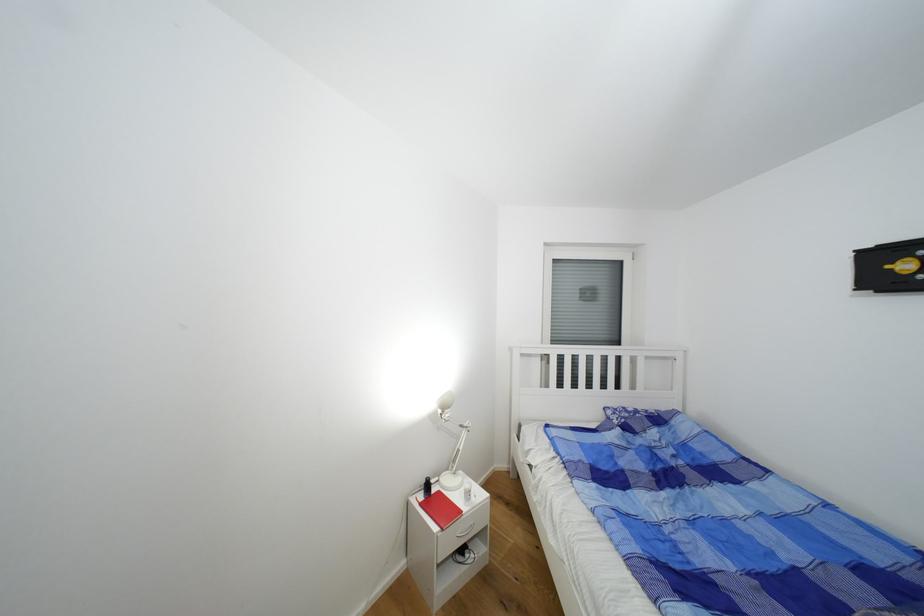
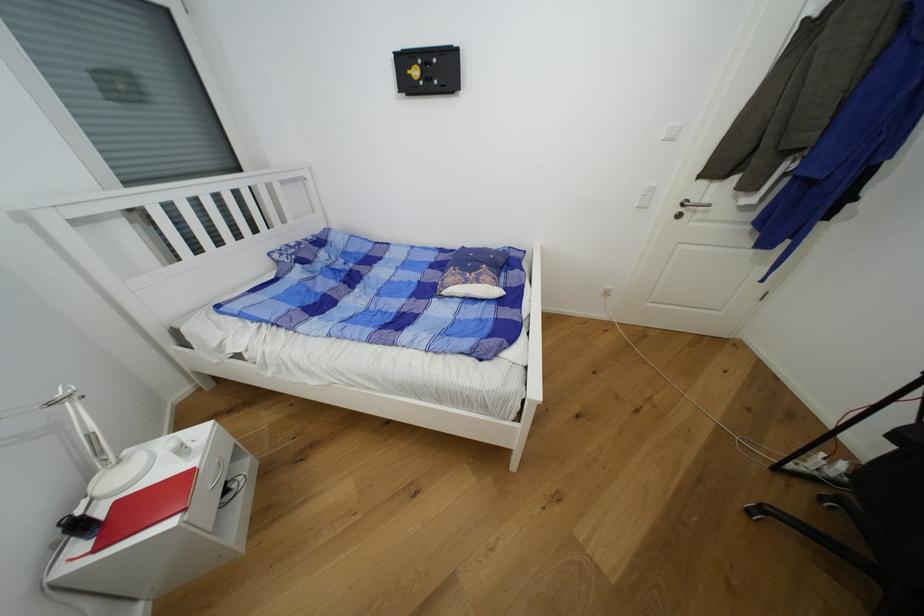
Based on the continuous images, in which direction is the camera rotating?

The camera's rotation is toward right-down.